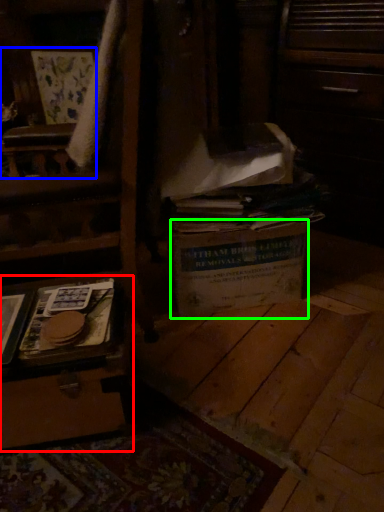
Question: Based on their relative distances, which object is nearer to vanity (highlighted by a red box)? Choose from armchair (highlighted by a blue box) and cardboard box (highlighted by a green box).

Choices:
 (A) armchair
 (B) cardboard box

Answer: (B)